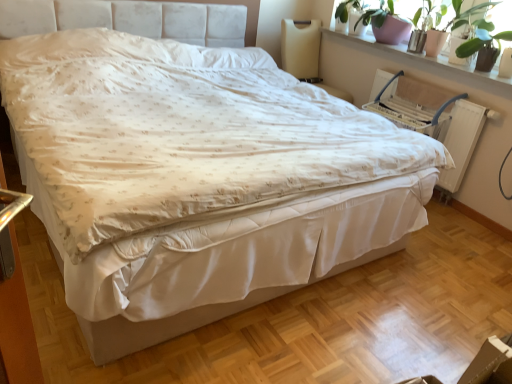
Question: Is white wood window sill at upper right in front of green glossy plant at upper right, the 2th plant positioned from the front?

Choices:
 (A) yes
 (B) no

Answer: (A)

Question: Is white wood window sill at upper right turned away from green glossy plant at upper right, the 2th plant positioned from the front?

Choices:
 (A) yes
 (B) no

Answer: (B)

Question: Is green glossy plant at upper right, which is the first plant in back-to-front order, a part of white wood window sill at upper right?

Choices:
 (A) yes
 (B) no

Answer: (B)

Question: Considering the relative positions of white wood window sill at upper right and green glossy plant at upper right, which is the first plant in back-to-front order, in the image provided, is white wood window sill at upper right to the left of green glossy plant at upper right, which is the first plant in back-to-front order, from the viewer's perspective?

Choices:
 (A) yes
 (B) no

Answer: (A)

Question: From a real-world perspective, is white wood window sill at upper right below green glossy plant at upper right, which is the first plant in back-to-front order?

Choices:
 (A) yes
 (B) no

Answer: (A)

Question: From a real-world perspective, is green leafy plant at upper right, the first plant in the front-to-back sequence, physically located above or below white wood window sill at upper right?

Choices:
 (A) above
 (B) below

Answer: (A)

Question: Looking at their shapes, would you say green leafy plant at upper right, the 2th plant viewed from the back, is wider or thinner than white wood window sill at upper right?

Choices:
 (A) wide
 (B) thin

Answer: (B)

Question: Is point (489, 46) positioned closer to the camera than point (473, 76)?

Choices:
 (A) farther
 (B) closer

Answer: (B)

Question: Is green leafy plant at upper right, the first plant in the front-to-back sequence, inside the boundaries of white wood window sill at upper right, or outside?

Choices:
 (A) inside
 (B) outside

Answer: (B)

Question: From a real-world perspective, is white wood window sill at upper right physically located above or below beige fabric swivel chair at upper right?

Choices:
 (A) above
 (B) below

Answer: (A)

Question: From the image's perspective, is white wood window sill at upper right located above or below beige fabric swivel chair at upper right?

Choices:
 (A) below
 (B) above

Answer: (A)

Question: Is white wood window sill at upper right inside the boundaries of beige fabric swivel chair at upper right, or outside?

Choices:
 (A) inside
 (B) outside

Answer: (B)

Question: From their relative heights in the image, would you say white wood window sill at upper right is taller or shorter than beige fabric swivel chair at upper right?

Choices:
 (A) short
 (B) tall

Answer: (A)

Question: Considering the relative positions of beige fabric swivel chair at upper right and green leafy plant at upper right, the 2th plant viewed from the back, in the image provided, is beige fabric swivel chair at upper right to the left or to the right of green leafy plant at upper right, the 2th plant viewed from the back,?

Choices:
 (A) right
 (B) left

Answer: (B)

Question: From a real-world perspective, relative to green leafy plant at upper right, the first plant in the front-to-back sequence, is beige fabric swivel chair at upper right vertically above or below?

Choices:
 (A) below
 (B) above

Answer: (A)